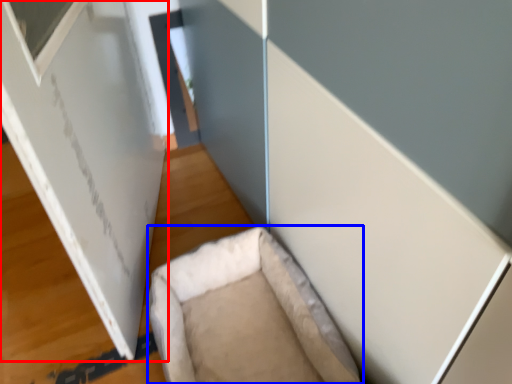
Question: Among these objects, which one is farthest to the camera, bulletin board (highlighted by a red box) or furniture (highlighted by a blue box)?

Choices:
 (A) bulletin board
 (B) furniture

Answer: (B)